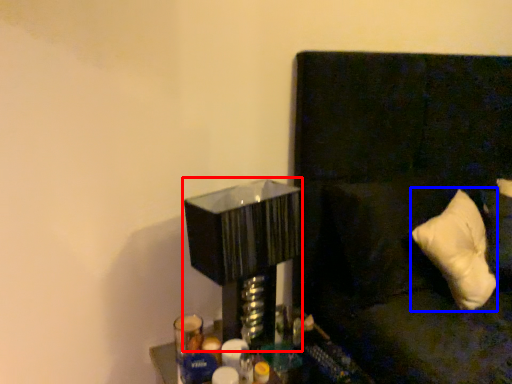
Question: Which object appears closest to the camera in this image, table lamp (highlighted by a red box) or pillow (highlighted by a blue box)?

Choices:
 (A) table lamp
 (B) pillow

Answer: (A)